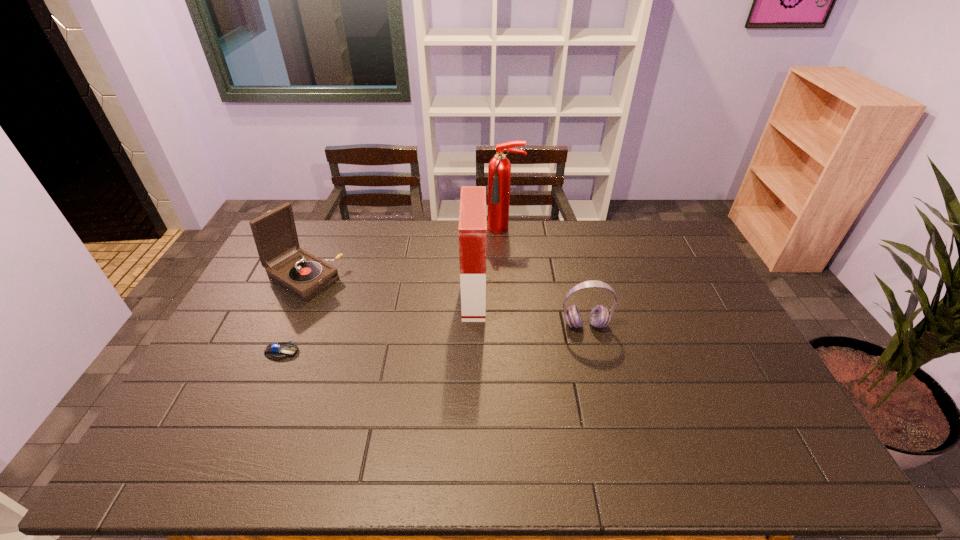
Locate an element on the screen. vacant region located 0.150m on the right of the third tallest object is located at coordinates (384, 278).

The image size is (960, 540). In order to click on free space located on the headband and ear cups of the headset in this screenshot , I will do `click(614, 446)`.

At what (x,y) coordinates should I click in order to perform the action: click on vacant space positioned on the button side of the nearest object. Please return your answer as a coordinate pair (x, y). Looking at the image, I should click on (405, 352).

Identify the location of fire extinguisher that is at the far edge. (499, 168).

Identify the location of phonograph record at the far edge. The height and width of the screenshot is (540, 960). (304, 275).

This screenshot has height=540, width=960. Find the location of `phonograph record that is at the left edge`. phonograph record that is at the left edge is located at coordinates (304, 275).

Where is `computer mouse located at the left edge`? This screenshot has height=540, width=960. computer mouse located at the left edge is located at coordinates (277, 351).

Locate an element on the screen. object present at the far left corner is located at coordinates (304, 275).

Image resolution: width=960 pixels, height=540 pixels. I want to click on vacant region at the far edge of the desktop, so click(x=585, y=220).

You are a GUI agent. You are given a task and a screenshot of the screen. Output one action in this format:
    pyautogui.click(x=<x>, y=<y>)
    Task: Click on the vacant space at the near edge of the desktop
    The height and width of the screenshot is (540, 960).
    Given the screenshot: What is the action you would take?
    pyautogui.click(x=301, y=473)